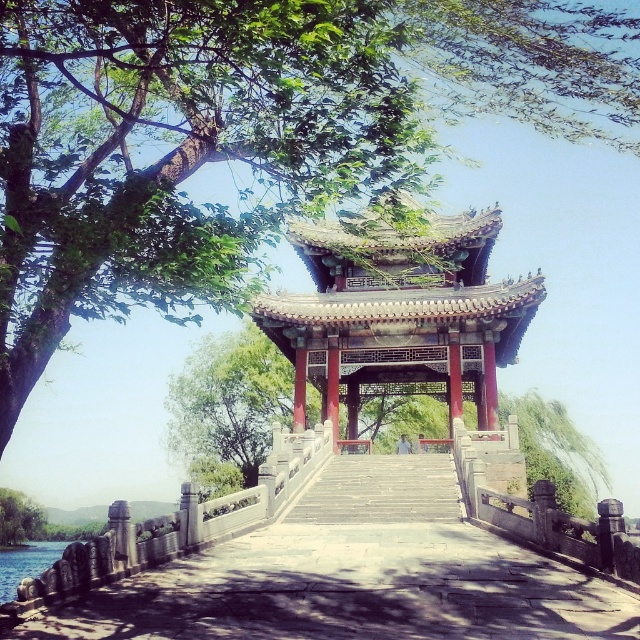
Question: Is clear water at lower left wider than green leafy tree at lower left?

Choices:
 (A) yes
 (B) no

Answer: (A)

Question: Does gray stone bridge at center have a smaller size compared to clear water at lower left?

Choices:
 (A) no
 (B) yes

Answer: (B)

Question: Considering the real-world distances, which object is closest to the wooden stairs at center?

Choices:
 (A) gray stone bridge at center
 (B) green leafy tree at center

Answer: (A)

Question: Which point is farther to the camera?

Choices:
 (A) stone/wooden gazebo at center
 (B) wooden stairs at center

Answer: (B)

Question: Can you confirm if wooden stairs at center is bigger than clear water at lower left?

Choices:
 (A) no
 (B) yes

Answer: (A)

Question: Which object is closer to the camera taking this photo?

Choices:
 (A) stone/wooden gazebo at center
 (B) wooden stairs at center
 (C) gray stone bridge at center
 (D) clear water at lower left

Answer: (C)